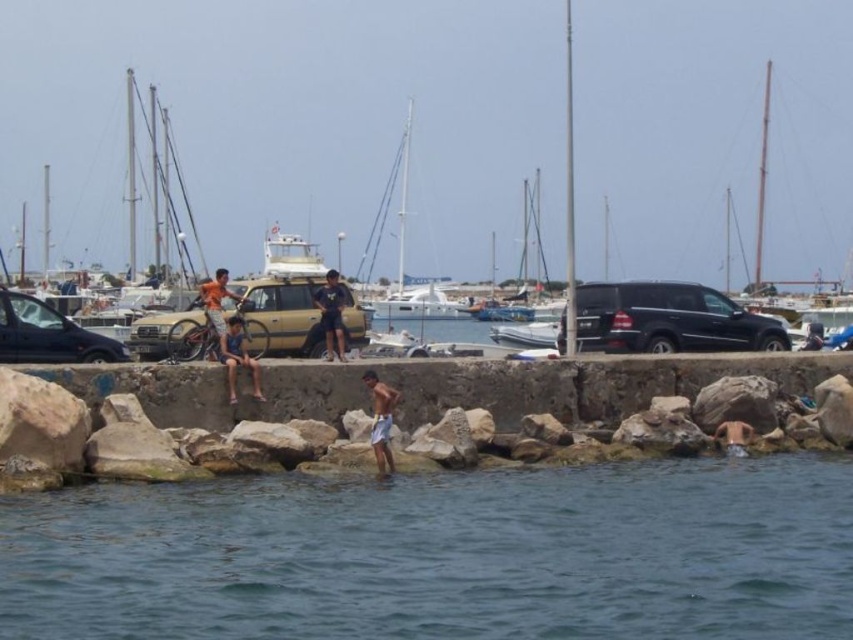
You are standing at the point with coordinates 0.5, 0.5 in the image. You want to walk to the blue water at lower center. Which direction should you walk? Please answer with a direction like north, south, east, west, or a combination like northeast.

Since the blue water at lower center is located at point (440, 554) and you are at (426, 320), you should walk east to reach it.